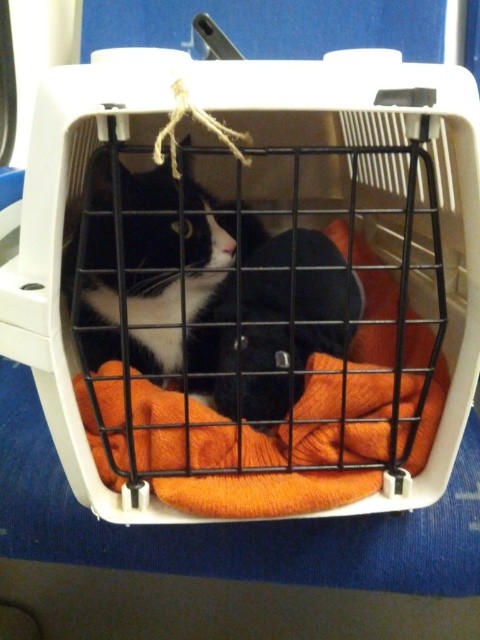
What do you see at coordinates (376, 144) in the screenshot?
I see `orange knitted laundry basket at center` at bounding box center [376, 144].

Is orange knitted laundry basket at center behind black matte fur cat at center?

No, it is in front of black matte fur cat at center.

Locate an element on the screen. The width and height of the screenshot is (480, 640). orange knitted laundry basket at center is located at coordinates (376, 144).

You are a GUI agent. You are given a task and a screenshot of the screen. Output one action in this format:
    pyautogui.click(x=<x>, y=<y>)
    Task: Click on the orange knitted laundry basket at center
    The width and height of the screenshot is (480, 640).
    Given the screenshot: What is the action you would take?
    pyautogui.click(x=376, y=144)